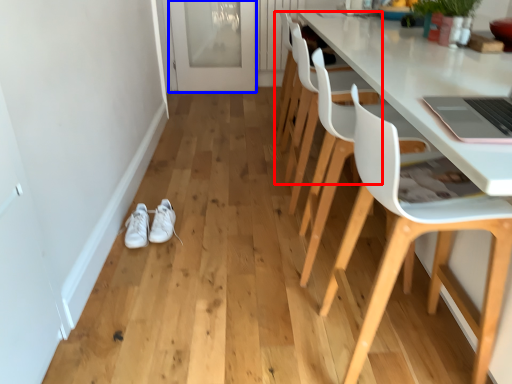
Question: Among these objects, which one is farthest to the camera, chair (highlighted by a red box) or glass door (highlighted by a blue box)?

Choices:
 (A) chair
 (B) glass door

Answer: (B)